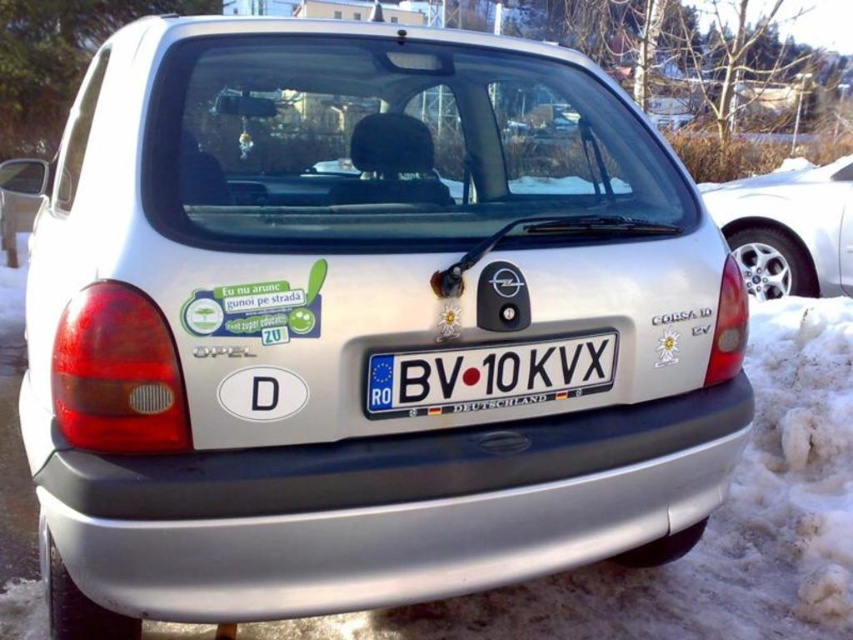
Question: Which point is farther to the camera?

Choices:
 (A) (35, 166)
 (B) (561, 374)
 (C) (743, 236)

Answer: (C)

Question: Can you confirm if white glossy car at right is positioned below blue metallic license plate at center?

Choices:
 (A) yes
 (B) no

Answer: (B)

Question: Does white glossy car at right appear under satin silver car at left?

Choices:
 (A) yes
 (B) no

Answer: (A)

Question: Which of the following is the farthest from the observer?

Choices:
 (A) (424, 380)
 (B) (724, 182)
 (C) (7, 168)
 (D) (195, 481)

Answer: (C)

Question: Does black rubber bumper at center appear under satin silver car at left?

Choices:
 (A) no
 (B) yes

Answer: (B)

Question: Which of these objects is positioned closest to the blue metallic license plate at center?

Choices:
 (A) black rubber bumper at center
 (B) white glossy car at right
 (C) satin silver car at left

Answer: (A)